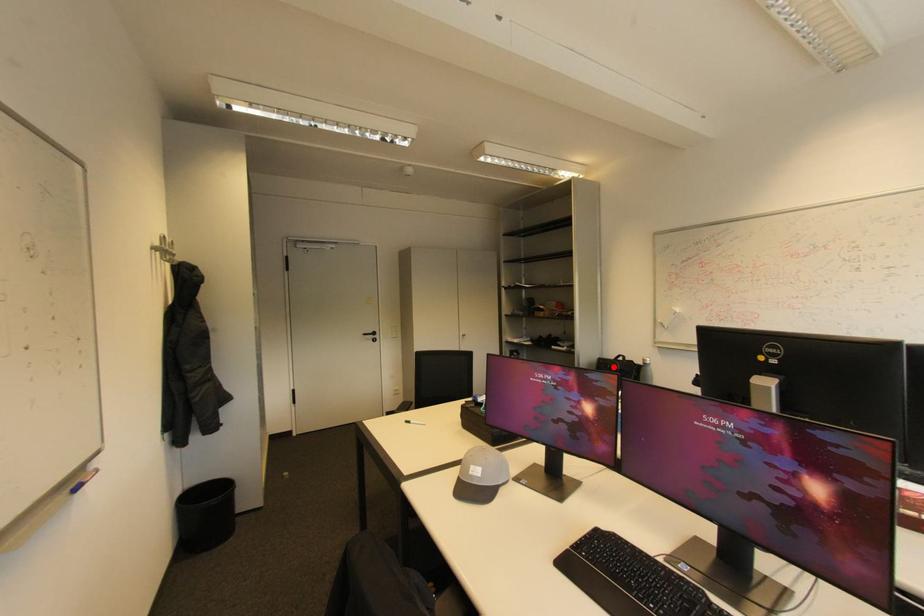
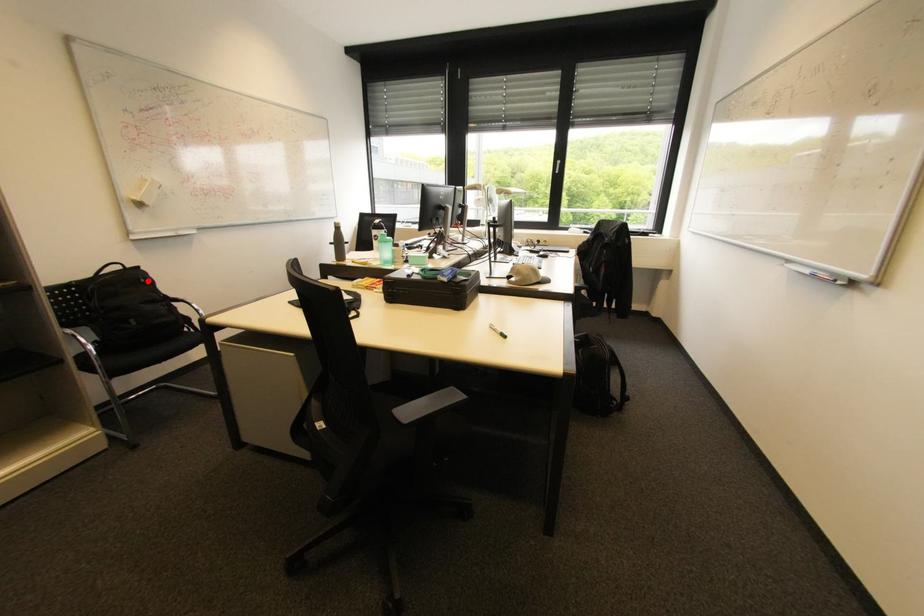
I am providing you with two images of the same scene from different viewpoints. A red point is marked on the first image and another point is marked on the second image. Are the points marked in image1 and image2 representing the same 3D position?

Yes